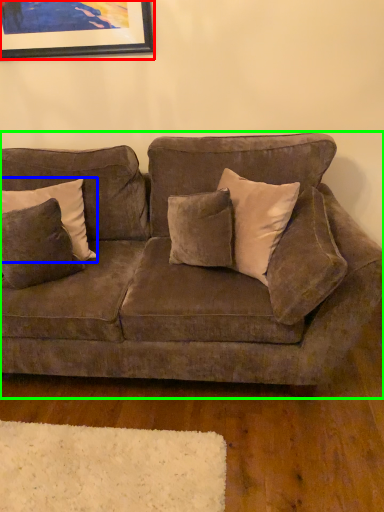
Question: Which is farther away from picture frame (highlighted by a red box)? pillow (highlighted by a blue box) or studio couch (highlighted by a green box)?

Choices:
 (A) pillow
 (B) studio couch

Answer: (B)